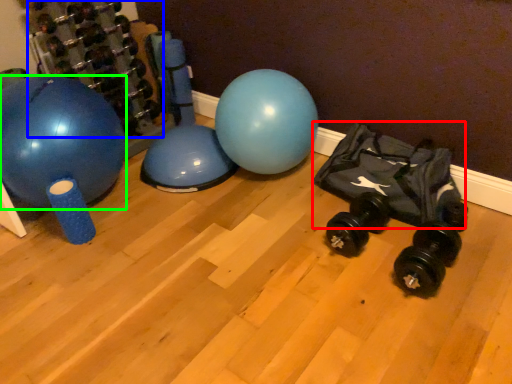
Question: Considering the real-world distances, which object is farthest from bean bag chair (highlighted by a red box)? dumbbell (highlighted by a blue box) or ball (highlighted by a green box)?

Choices:
 (A) dumbbell
 (B) ball

Answer: (A)